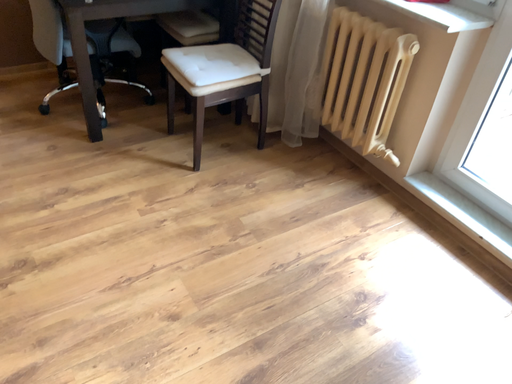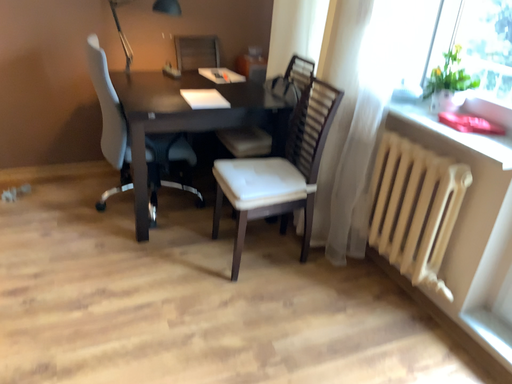
Question: How did the camera likely rotate when shooting the video?

Choices:
 (A) rotated left
 (B) rotated right

Answer: (A)